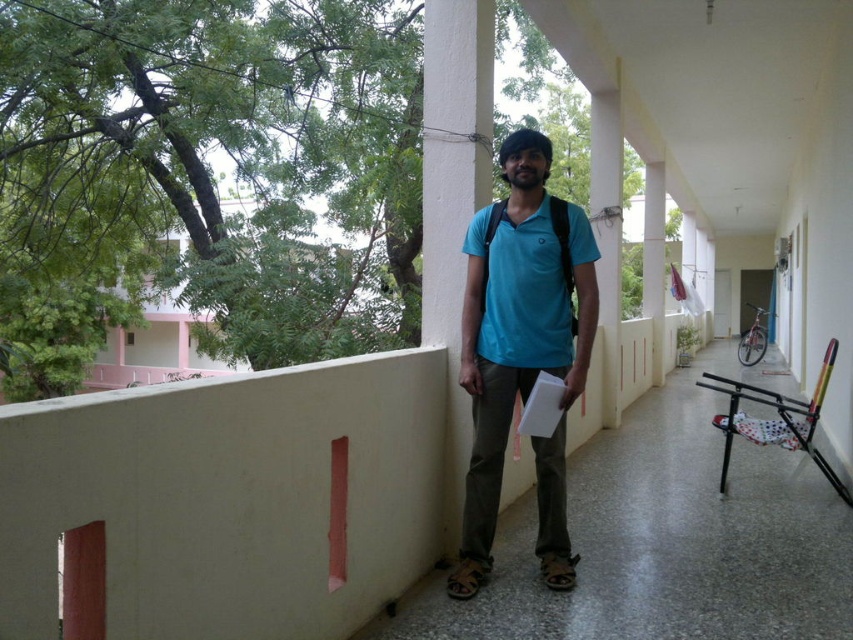
Question: Which object appears farthest from the camera in this image?

Choices:
 (A) white smooth pillar at center
 (B) matte blue shirt at center

Answer: (A)

Question: Is matte blue shirt at center above white smooth pillar at center?

Choices:
 (A) yes
 (B) no

Answer: (B)

Question: Is the position of matte blue shirt at center less distant than that of white smooth pillar at center?

Choices:
 (A) no
 (B) yes

Answer: (B)

Question: Can you confirm if matte blue shirt at center is positioned to the left of white smooth pillar at center?

Choices:
 (A) no
 (B) yes

Answer: (A)

Question: Which of the following is the closest to the observer?

Choices:
 (A) (444, 49)
 (B) (514, 326)

Answer: (B)